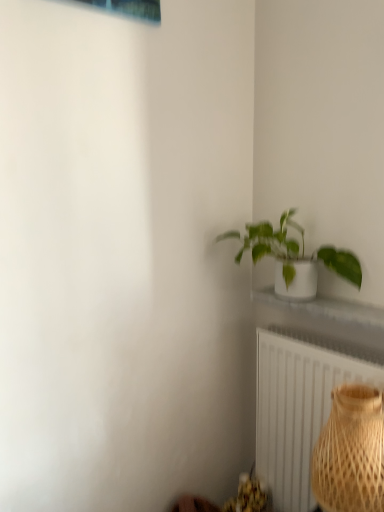
Question: Are green glossy plant at upper right and bamboo textured vase at lower right far apart?

Choices:
 (A) yes
 (B) no

Answer: (B)

Question: Does green glossy plant at upper right come behind bamboo textured vase at lower right?

Choices:
 (A) yes
 (B) no

Answer: (A)

Question: Is green glossy plant at upper right wider than bamboo textured vase at lower right?

Choices:
 (A) yes
 (B) no

Answer: (B)

Question: Considering the relative sizes of green glossy plant at upper right and bamboo textured vase at lower right in the image provided, is green glossy plant at upper right shorter than bamboo textured vase at lower right?

Choices:
 (A) yes
 (B) no

Answer: (A)

Question: Is green glossy plant at upper right at the right side of bamboo textured vase at lower right?

Choices:
 (A) yes
 (B) no

Answer: (B)

Question: Can bamboo textured vase at lower right be found inside green glossy plant at upper right?

Choices:
 (A) yes
 (B) no

Answer: (B)

Question: Is bamboo textured vase at lower right far away from white textured radiator at lower right?

Choices:
 (A) yes
 (B) no

Answer: (B)

Question: Is white textured radiator at lower right inside bamboo textured vase at lower right?

Choices:
 (A) no
 (B) yes

Answer: (A)

Question: Does bamboo textured vase at lower right have a smaller size compared to white textured radiator at lower right?

Choices:
 (A) yes
 (B) no

Answer: (A)

Question: Can you confirm if bamboo textured vase at lower right is bigger than white textured radiator at lower right?

Choices:
 (A) no
 (B) yes

Answer: (A)

Question: Is bamboo textured vase at lower right at the right side of white textured radiator at lower right?

Choices:
 (A) yes
 (B) no

Answer: (A)

Question: Is bamboo textured vase at lower right positioned behind white textured radiator at lower right?

Choices:
 (A) yes
 (B) no

Answer: (B)

Question: Is white textured radiator at lower right located within green glossy plant at upper right?

Choices:
 (A) yes
 (B) no

Answer: (B)